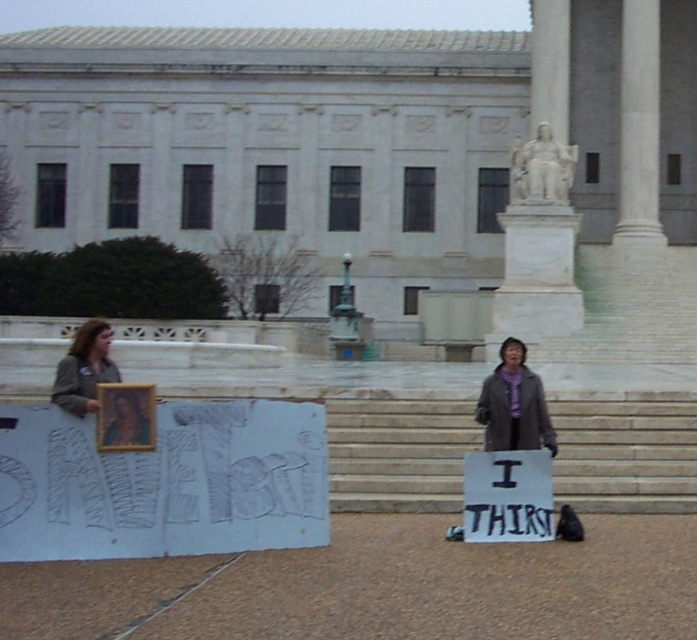
You are a delivery person trying to reach the entrance of the building. The entrance is located above the white marble column at center. You are currently standing on the white stone stairs at center. Can you directly walk to the entrance from your current position?

The white stone stairs at center is below the white marble column at center, so the entrance above the white marble column at center is accessible by climbing the stairs. Yes, you can directly walk to the entrance from the white stone stairs at center.

You are a photographer standing in front of the classical building. You want to take a photo of the green fabric jacket at left and the white marble column at center. Based on their positions, can you see both objects clearly in the same frame without moving your camera?

The green fabric jacket at left is behind the white marble column at center, so the jacket will be partially or fully obscured by the column in the photo. You cannot see both clearly in the same frame without moving the camera.

You are standing at the point with coordinates point (76, 410) and want to walk towards the building. Is the point (635, 196) blocking your path?

Point (635, 196) is behind point (76, 410), so it is not blocking your path to the building.